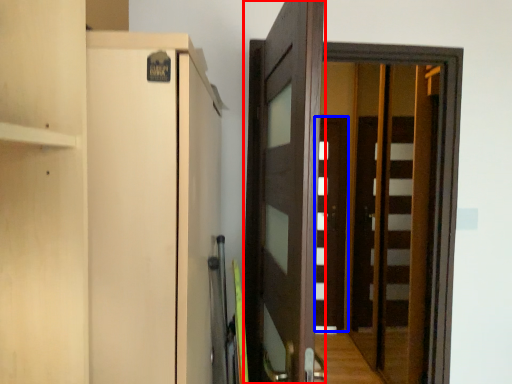
Question: Which object is closer to the camera taking this photo, door (highlighted by a red box) or door (highlighted by a blue box)?

Choices:
 (A) door
 (B) door

Answer: (A)